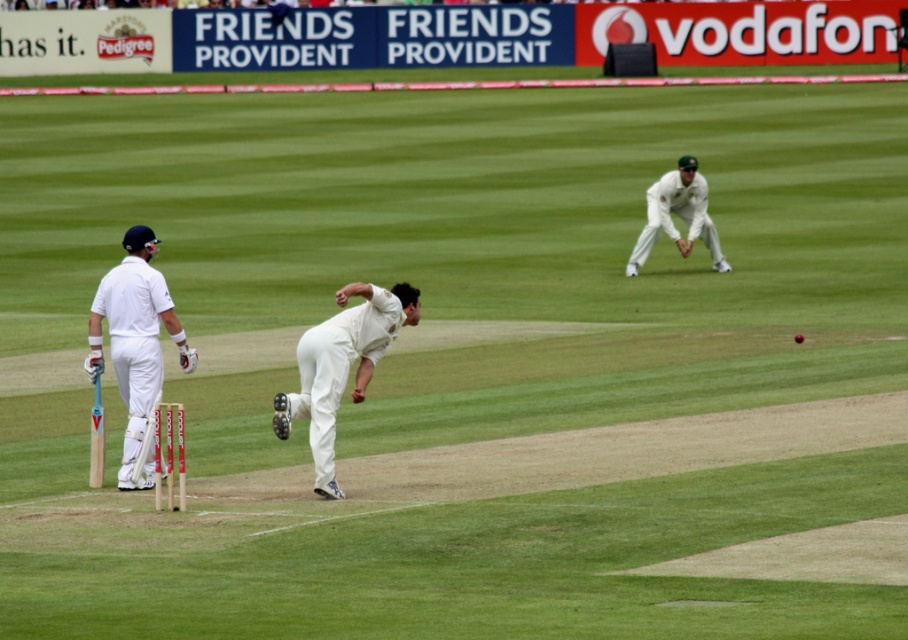
Question: Among these points, which one is nearest to the camera?

Choices:
 (A) (385, 324)
 (B) (712, 230)
 (C) (183, 364)

Answer: (A)

Question: Can you confirm if white matte cricket ball at center is smaller than white cloth glove at upper right?

Choices:
 (A) no
 (B) yes

Answer: (B)

Question: Is white matte cricket bat at left bigger than white cloth glove at upper right?

Choices:
 (A) no
 (B) yes

Answer: (A)

Question: Which point appears closest to the camera in this image?

Choices:
 (A) (324, 456)
 (B) (147, 236)
 (C) (670, 227)

Answer: (A)

Question: Which object is the farthest from the white matte cricket bat at left?

Choices:
 (A) white cloth glove at upper right
 (B) white matte cricket ball at center

Answer: (A)

Question: Is white matte cricket bat at left below white cloth glove at upper right?

Choices:
 (A) yes
 (B) no

Answer: (A)